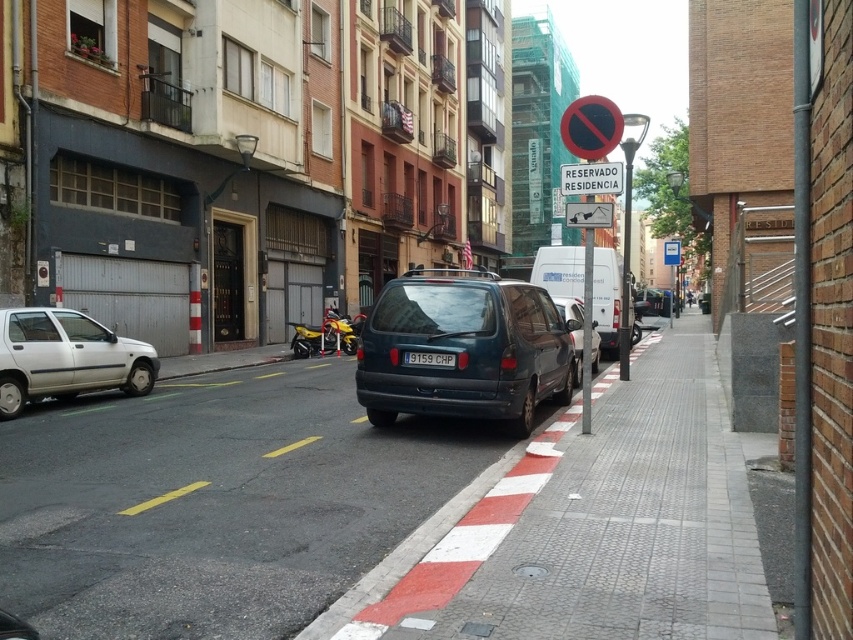
Question: Among these points, which one is farthest from the camera?

Choices:
 (A) (415, 358)
 (B) (672, 285)
 (C) (616, 317)
 (D) (9, 516)

Answer: (B)

Question: Which object appears closest to the camera in this image?

Choices:
 (A) black plastic license plate at center
 (B) white plastic sign at upper center
 (C) silver metallic hatchback at left
 (D) white plastic sign at center

Answer: (B)

Question: Is silver metallic hatchback at left below black plastic license plate at center?

Choices:
 (A) no
 (B) yes

Answer: (B)

Question: Is white matte van at center above white plastic sign at center?

Choices:
 (A) yes
 (B) no

Answer: (B)

Question: Is white textured pavement at lower right below white plastic sign at center?

Choices:
 (A) yes
 (B) no

Answer: (A)

Question: Which point is closer to the camera?

Choices:
 (A) black plastic license plate at center
 (B) white textured pavement at lower right

Answer: (B)